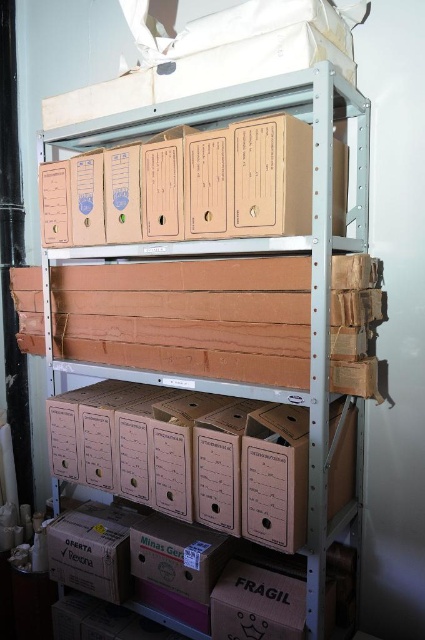
You are standing in front of the metal shelving unit and notice two points marked on the top shelf. From your perspective, which point is closer to you? The points are labeled as point (172, 456) and point (323, 477).

Point (323, 477) is closer to you because it is in front of point (172, 456).

You are organizing items on the top shelf of the metal shelving unit. You have a cardboard box at center and brown cardboard boxes at center. Which one takes up less vertical space?

The cardboard box at center is thinner than the brown cardboard boxes at center, so it takes up less vertical space.

You are organizing items on the top shelf of the metal shelving unit. You need to place a new item between the cardboard box at center and the brown cardboard boxes at center. Is this possible?

The cardboard box at center is positioned under the brown cardboard boxes at center, so they are stacked vertically. Since they are stacked, there is no space between them horizontally to place a new item between them. Therefore, it is not possible to place the new item between them.